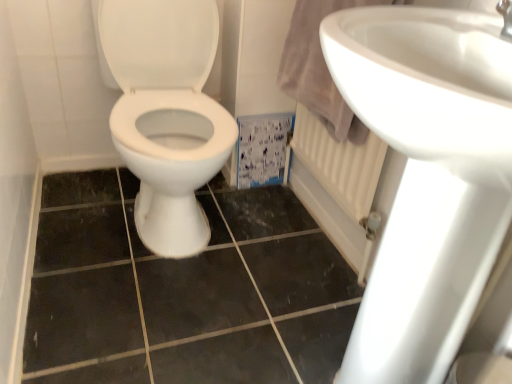
Question: From the image's perspective, does black ceramic tile at center appear lower than white glossy sink at upper right?

Choices:
 (A) yes
 (B) no

Answer: (A)

Question: Can you confirm if black ceramic tile at center is bigger than white glossy sink at upper right?

Choices:
 (A) no
 (B) yes

Answer: (A)

Question: Is black ceramic tile at center wider than white glossy sink at upper right?

Choices:
 (A) yes
 (B) no

Answer: (A)

Question: Is black ceramic tile at center located outside white glossy sink at upper right?

Choices:
 (A) yes
 (B) no

Answer: (A)

Question: From a real-world perspective, is black ceramic tile at center located beneath white glossy sink at upper right?

Choices:
 (A) yes
 (B) no

Answer: (A)

Question: From a real-world perspective, does black ceramic tile at center stand above white glossy sink at upper right?

Choices:
 (A) no
 (B) yes

Answer: (A)

Question: Does white glossy sink at upper right contain black ceramic tile at center?

Choices:
 (A) no
 (B) yes

Answer: (A)

Question: Is white glossy sink at upper right outside black ceramic tile at center?

Choices:
 (A) yes
 (B) no

Answer: (A)

Question: Is white glossy sink at upper right beside black ceramic tile at center?

Choices:
 (A) yes
 (B) no

Answer: (B)

Question: Considering the relative sizes of white glossy sink at upper right and black ceramic tile at center in the image provided, is white glossy sink at upper right taller than black ceramic tile at center?

Choices:
 (A) yes
 (B) no

Answer: (A)

Question: Does white glossy sink at upper right have a lesser height compared to black ceramic tile at center?

Choices:
 (A) no
 (B) yes

Answer: (A)

Question: Is the depth of white glossy sink at upper right less than that of black ceramic tile at center?

Choices:
 (A) no
 (B) yes

Answer: (B)

Question: Looking at their shapes, would you say white glossy sink at upper right is wider or thinner than black ceramic tile at center?

Choices:
 (A) thin
 (B) wide

Answer: (A)